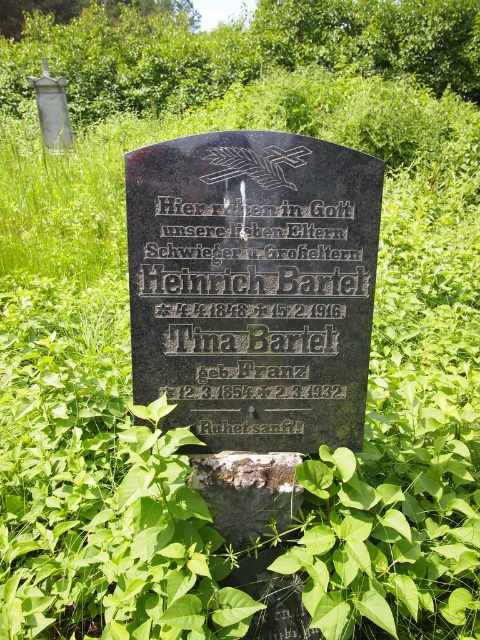
You are a maintenance worker in a cemetery. You need to place a new flowerpot between the black polished stone plaque at center and the rusty metal gravestone at center. The flowerpot requires a minimum of 12 inches of space. Can you fit it there?

The distance between the black polished stone plaque at center and the rusty metal gravestone at center is 14.33 inches, which is more than the required 12 inches. Therefore, the flowerpot can be placed between them.

What is the relationship between the heights of the black polished stone plaque at center and the rusty metal gravestone at center?

The black polished stone plaque at center has a greater height compared to the rusty metal gravestone at center.

Based on the scene description, which object is bigger between the black polished stone plaque at center and the rusty metal gravestone at center?

The black polished stone plaque at center is larger in size than the rusty metal gravestone at center according to the description.